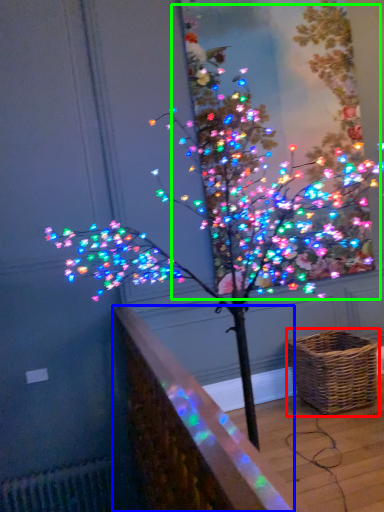
Question: Which object is the farthest from picnic basket (highlighted by a red box)? Choose among these: ledge (highlighted by a blue box) or christmas tree (highlighted by a green box).

Choices:
 (A) ledge
 (B) christmas tree

Answer: (A)